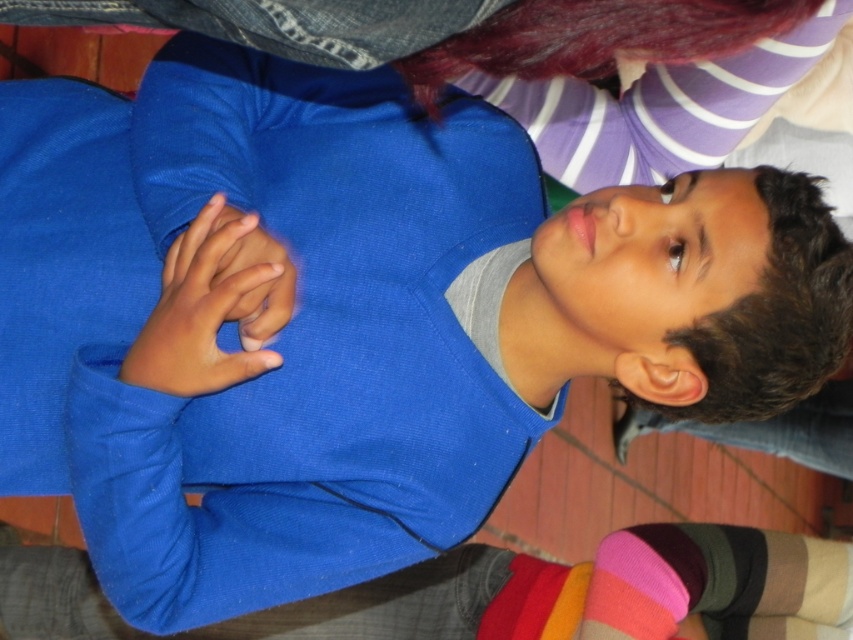
Question: Which of the following is the farthest from the observer?

Choices:
 (A) (642, 625)
 (B) (210, 356)

Answer: (A)

Question: Does smooth blue hand at center have a lesser width compared to pink knitted sock at lower right?

Choices:
 (A) yes
 (B) no

Answer: (A)

Question: Is smooth blue hand at center smaller than pink knitted sock at lower right?

Choices:
 (A) no
 (B) yes

Answer: (B)

Question: Among these points, which one is nearest to the camera?

Choices:
 (A) (277, 355)
 (B) (608, 548)

Answer: (A)

Question: Can you confirm if smooth blue hand at center is positioned below pink knitted sock at lower right?

Choices:
 (A) yes
 (B) no

Answer: (B)